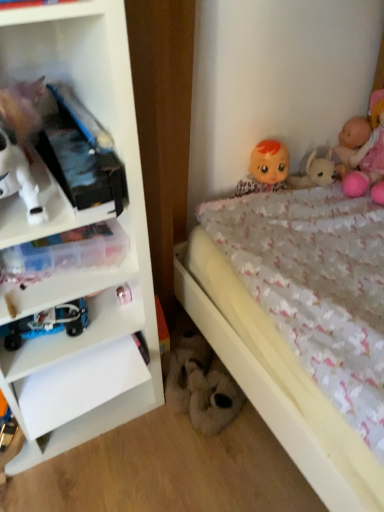
Question: Which direction should I rotate to look at fluffy white plush at lower center, the third toy when ordered from front to back, — up or down?

Choices:
 (A) down
 (B) up

Answer: (A)

Question: Is fluffy white plush at lower center, the third toy when ordered from front to back, at the left side of white plastic shelf at left?

Choices:
 (A) no
 (B) yes

Answer: (A)

Question: Is fluffy white plush at lower center, the first toy from the bottom, to the right of white plastic shelf at left from the viewer's perspective?

Choices:
 (A) yes
 (B) no

Answer: (A)

Question: Does fluffy white plush at lower center, which ranks as the 3th toy in left-to-right order, have a larger size compared to white plastic shelf at left?

Choices:
 (A) no
 (B) yes

Answer: (A)

Question: Could you tell me if fluffy white plush at lower center, the first toy from the right, is turned towards white plastic shelf at left?

Choices:
 (A) yes
 (B) no

Answer: (B)

Question: From the image's perspective, is fluffy white plush at lower center, the first toy from the right, over white plastic shelf at left?

Choices:
 (A) yes
 (B) no

Answer: (B)

Question: Is fluffy white plush at lower center, the third toy when ordered from front to back, directly adjacent to white plastic shelf at left?

Choices:
 (A) yes
 (B) no

Answer: (B)

Question: Is metallic silver toy at lower left, the second toy from the right, bigger than white plastic shelf at left?

Choices:
 (A) yes
 (B) no

Answer: (B)

Question: Is metallic silver toy at lower left, which appears as the second toy when viewed from the left, next to white plastic shelf at left and touching it?

Choices:
 (A) no
 (B) yes

Answer: (A)

Question: From the image's perspective, does metallic silver toy at lower left, which appears as the second toy when viewed from the back, appear lower than white plastic shelf at left?

Choices:
 (A) no
 (B) yes

Answer: (B)

Question: Considering the relative sizes of metallic silver toy at lower left, marked as the 2th toy in a front-to-back arrangement, and white plastic shelf at left in the image provided, is metallic silver toy at lower left, marked as the 2th toy in a front-to-back arrangement, wider than white plastic shelf at left?

Choices:
 (A) yes
 (B) no

Answer: (B)

Question: Is metallic silver toy at lower left, the second toy from the right, in front of white plastic shelf at left?

Choices:
 (A) yes
 (B) no

Answer: (B)

Question: Is metallic silver toy at lower left, marked as the 2th toy in a front-to-back arrangement, completely or partially outside of white plastic shelf at left?

Choices:
 (A) no
 (B) yes

Answer: (A)

Question: Considering the relative positions of pink plush doll at upper right, the third doll viewed from the left, and metallic silver toy at lower left, the second toy from the right, in the image provided, is pink plush doll at upper right, the third doll viewed from the left, in front of metallic silver toy at lower left, the second toy from the right,?

Choices:
 (A) no
 (B) yes

Answer: (A)